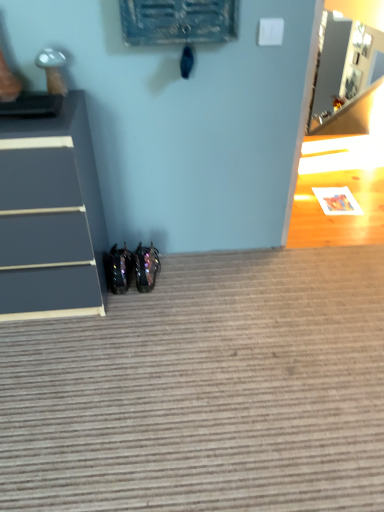
Image resolution: width=384 pixels, height=512 pixels. In order to click on space that is in front of matte gray chest of drawers at left in this screenshot , I will do `click(57, 361)`.